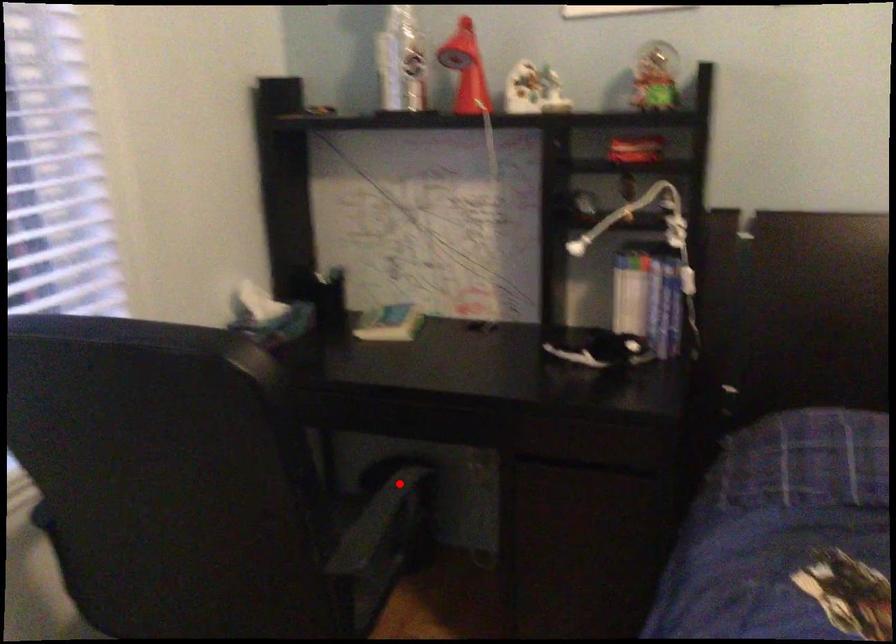
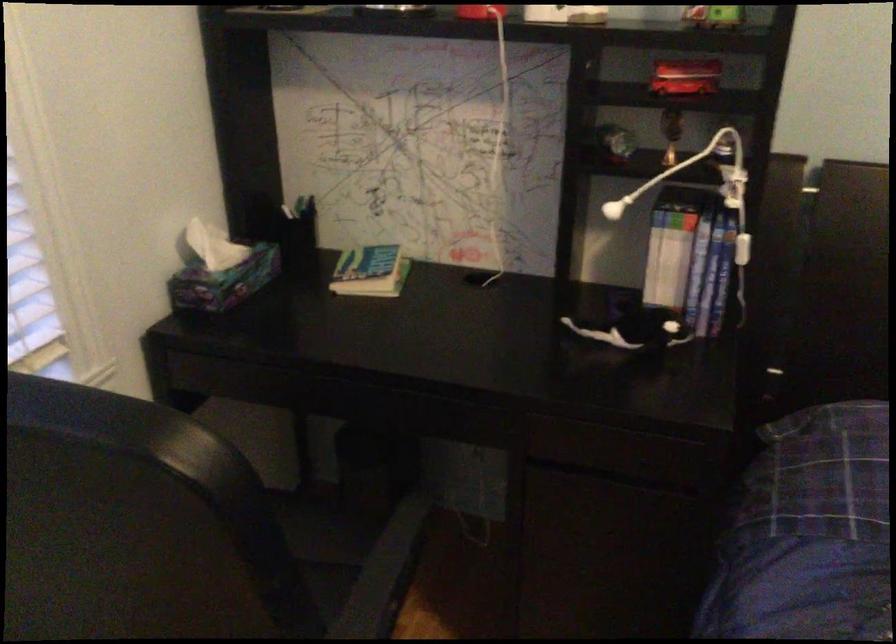
Locate, in the second image, the point that corresponds to the highlighted location in the first image.

(399, 536)